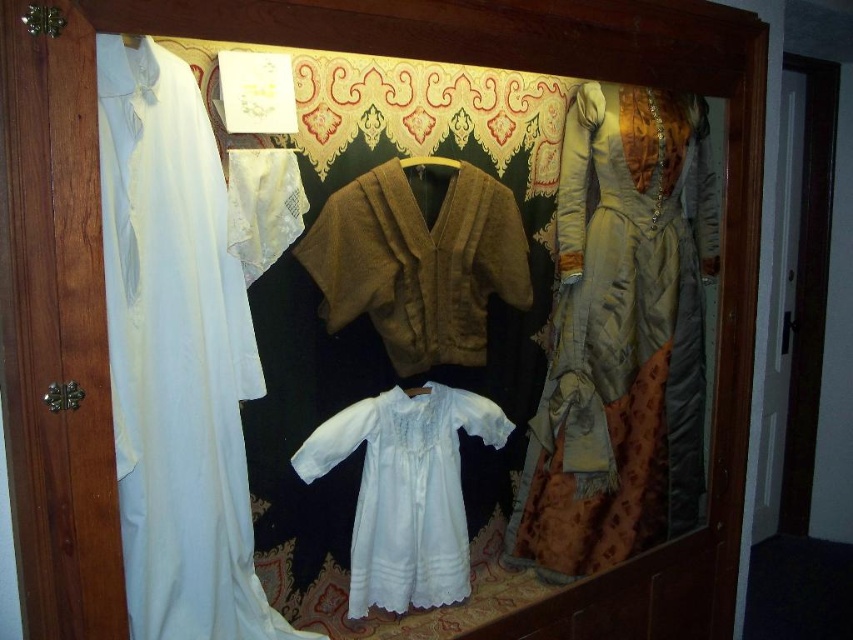
Question: Which object is farther from the camera taking this photo?

Choices:
 (A) brown textured sweater at center
 (B) white cotton robe at left
 (C) white lace dress at center
 (D) white satin dress at left

Answer: (C)

Question: Can you confirm if brown textured sweater at center is positioned below white lace dress at center?

Choices:
 (A) yes
 (B) no

Answer: (B)

Question: Among these objects, which one is farthest from the camera?

Choices:
 (A) white cotton robe at left
 (B) brown textured sweater at center
 (C) silky beige gown at right
 (D) white lace dress at center

Answer: (C)

Question: Which of the following is the closest to the observer?

Choices:
 (A) brown textured sweater at center
 (B) silky beige gown at right
 (C) white satin dress at left

Answer: (C)

Question: From the image, what is the correct spatial relationship of white cotton robe at left in relation to white lace dress at center?

Choices:
 (A) above
 (B) below

Answer: (A)

Question: From the image, what is the correct spatial relationship of brown textured sweater at center in relation to white lace dress at center?

Choices:
 (A) above
 (B) below

Answer: (A)